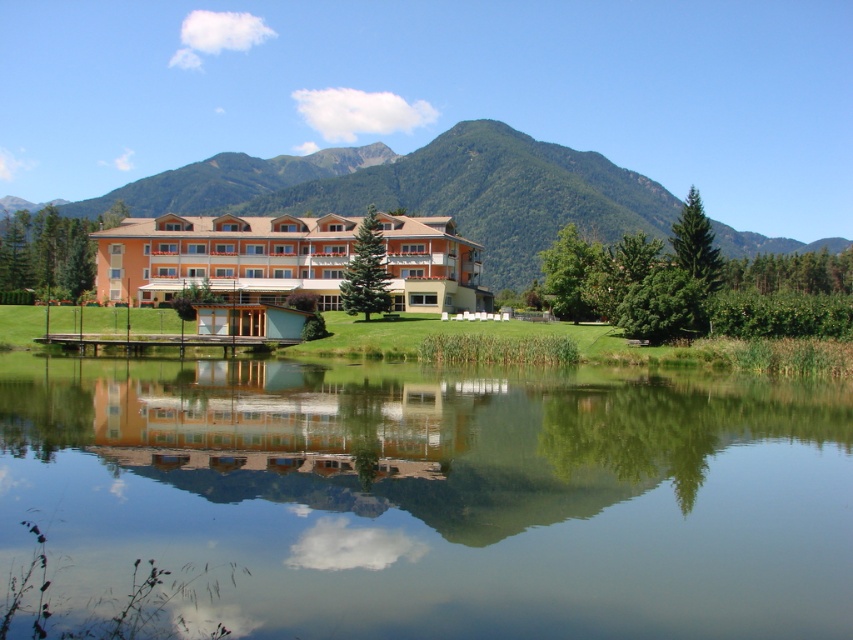
Which of these two, transparent glass water at center or green textured mountain at center, stands taller?

Standing taller between the two is green textured mountain at center.

This screenshot has height=640, width=853. What do you see at coordinates (438, 496) in the screenshot? I see `transparent glass water at center` at bounding box center [438, 496].

Does point (579, 552) come closer to viewer compared to point (467, 156)?

That is True.

The image size is (853, 640). Find the location of `transparent glass water at center`. transparent glass water at center is located at coordinates click(x=438, y=496).

Can you confirm if transparent glass water at center is positioned above orange matte building at center?

No, transparent glass water at center is not above orange matte building at center.

How distant is transparent glass water at center from orange matte building at center?

transparent glass water at center is 49.17 meters away from orange matte building at center.

Locate an element on the screen. transparent glass water at center is located at coordinates (438, 496).

Between green textured mountain at center and orange matte building at center, which one appears on the right side from the viewer's perspective?

green textured mountain at center is more to the right.

Identify the location of green textured mountain at center. (425, 192).